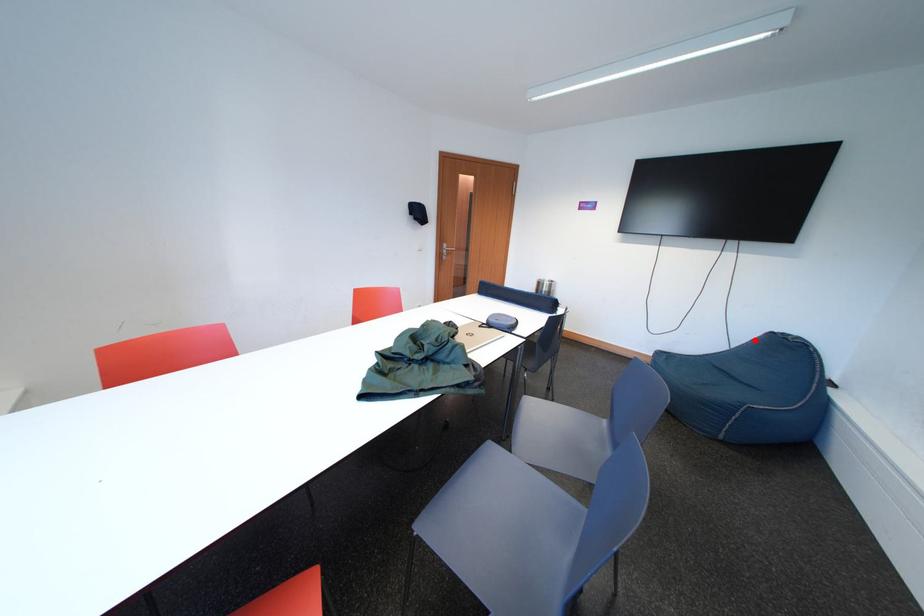
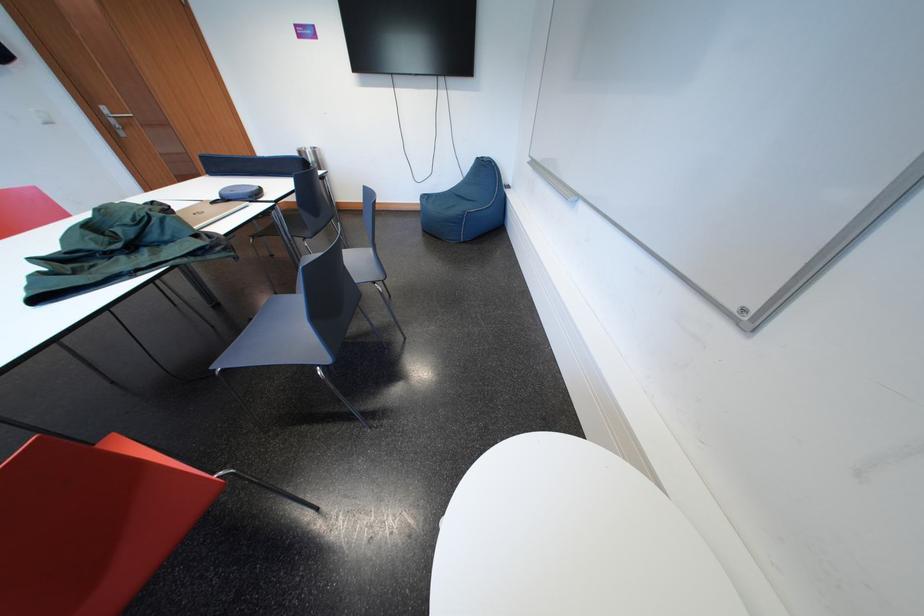
Question: I am providing you with two images of the same scene from different viewpoints. A red point is shown in image1. For the corresponding object point in image2, is it positioned nearer or farther from the camera?

Choices:
 (A) Nearer
 (B) Farther

Answer: (A)